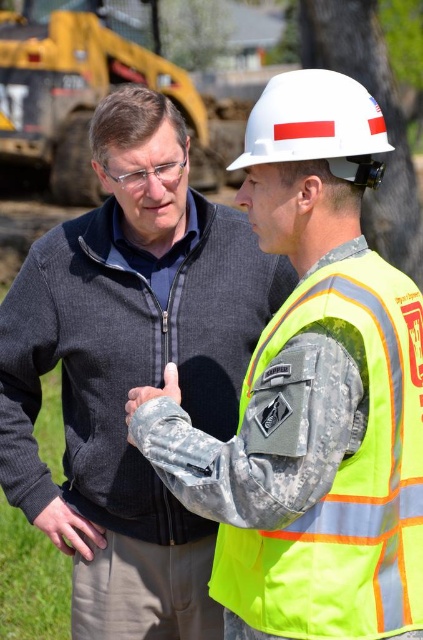
You are standing at the construction site and see two points marked in the image. The first point is at coordinates point [49,122] and the second is at point [132,413]. Which point is closer to you?

Point [49,122] is closer to you because it is further to the viewer than point [132,413].